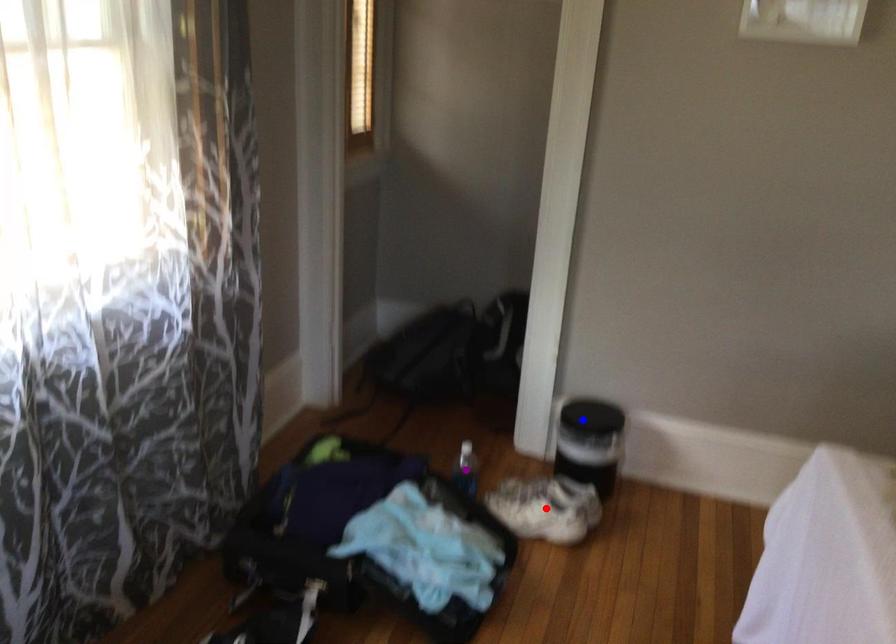
Order these from nearest to farthest:
blue point | red point | purple point

blue point
purple point
red point